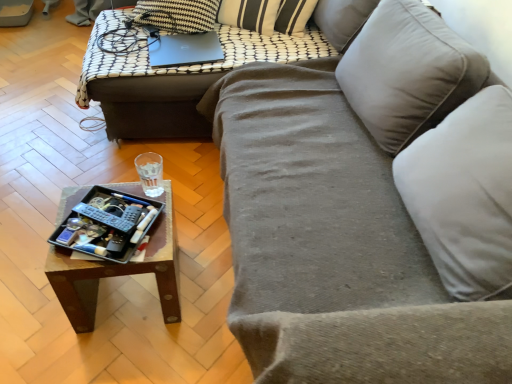
The height and width of the screenshot is (384, 512). In order to click on blank area to the left of wooden tray at center in this screenshot , I will do `click(30, 299)`.